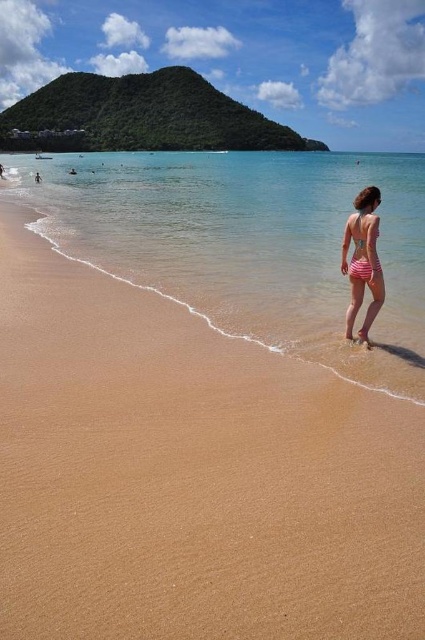
Question: Considering the real-world distances, which object is closest to the clear blue water at center?

Choices:
 (A) sandy tan beach at center
 (B) pink striped swimsuit at right

Answer: (A)

Question: Which of the following is the closest to the observer?

Choices:
 (A) sandy tan beach at center
 (B) pink striped swimsuit at right

Answer: (A)

Question: Which point is closer to the camera taking this photo?

Choices:
 (A) (365, 321)
 (B) (394, 237)
 (C) (237, 340)

Answer: (A)

Question: Is clear blue water at center closer to camera compared to pink striped swimsuit at right?

Choices:
 (A) yes
 (B) no

Answer: (A)

Question: From the image, what is the correct spatial relationship of clear blue water at center in relation to pink striped swimsuit at right?

Choices:
 (A) above
 (B) below

Answer: (A)

Question: Can you confirm if sandy tan beach at center is wider than pink striped swimsuit at right?

Choices:
 (A) no
 (B) yes

Answer: (B)